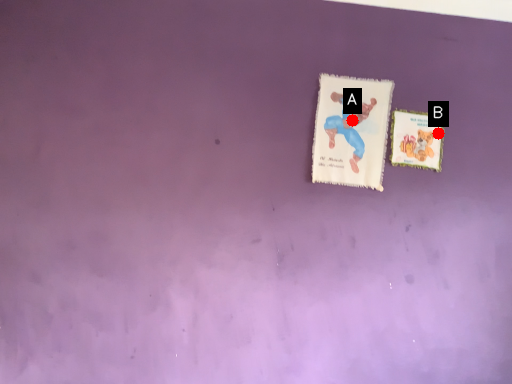
Question: Two points are circled on the image, labeled by A and B beside each circle. Which point appears closest to the camera in this image?

Choices:
 (A) A is closer
 (B) B is closer

Answer: (A)